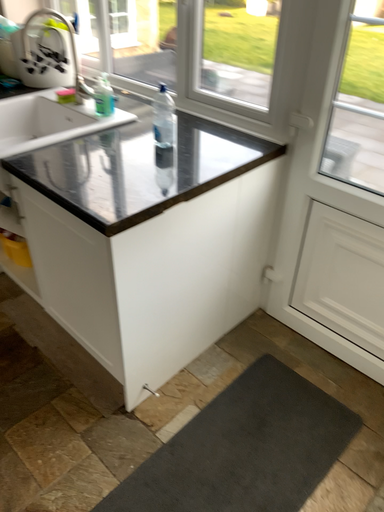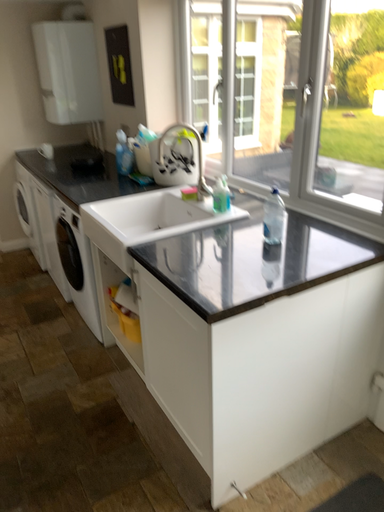
Question: How did the camera likely rotate when shooting the video?

Choices:
 (A) rotated left
 (B) rotated right

Answer: (A)